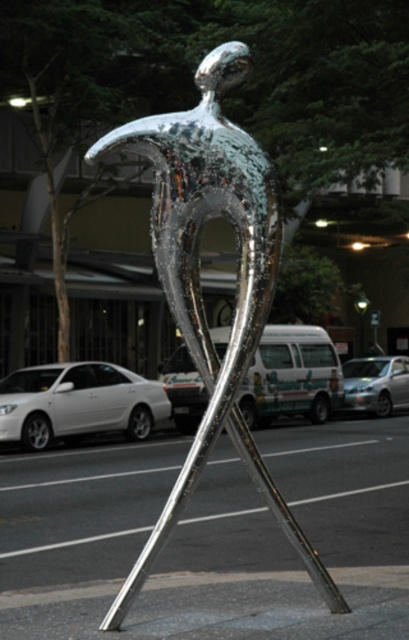
You are an art student who wants to create a scale model of the shiny metallic sculpture at center and the silver metallic car at left. Which object should you make smaller in your model to maintain the correct proportions?

The shiny metallic sculpture at center should be made smaller in the model since it is smaller in size compared to the silver metallic car at left according to the description.

You are standing in front of the public art installation and want to take a photo. You notice two points on the sculpture labeled as point (x=193, y=268) and point (x=325, y=337). Which point would appear larger in your camera view?

Point (x=193, y=268) is closer to the camera than point (x=325, y=337), so it would appear larger in the camera view.

You are a delivery driver who needs to park your truck between the shiny metallic sculpture at center and the shiny metallic van at center. Your truck is 18 meters long. Can your truck fit in the space between them?

The distance between the shiny metallic sculpture at center and the shiny metallic van at center is 21.50 meters. Since your truck is 18 meters long, there is enough space for it to fit between them with 3.5 meters to spare.